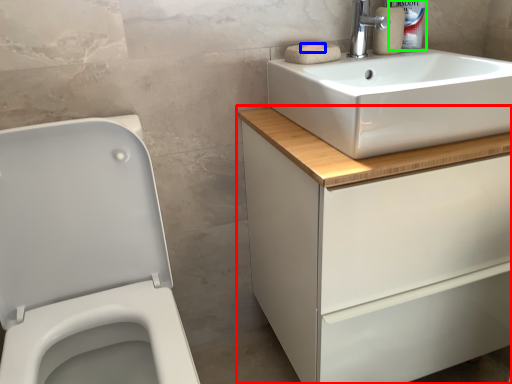
Question: Which object is the closest to the bathroom cabinet (highlighted by a red box)? Choose among these: soap (highlighted by a blue box) or cleaning product (highlighted by a green box).

Choices:
 (A) soap
 (B) cleaning product

Answer: (A)